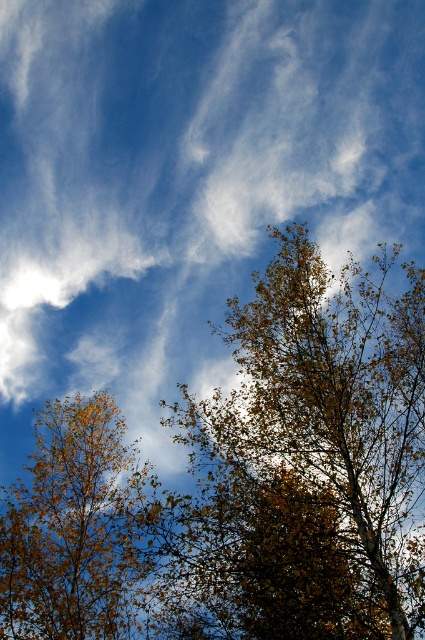
Question: Which of the following is the closest to the observer?

Choices:
 (A) brown leafy tree at center
 (B) golden-brown leaves at left

Answer: (A)

Question: Can you confirm if brown leafy tree at center is smaller than golden-brown leaves at left?

Choices:
 (A) no
 (B) yes

Answer: (A)

Question: Does brown leafy tree at center come in front of golden-brown leaves at left?

Choices:
 (A) no
 (B) yes

Answer: (B)

Question: Can you confirm if brown leafy tree at center is bigger than golden-brown leaves at left?

Choices:
 (A) yes
 (B) no

Answer: (A)

Question: Which of the following is the farthest from the observer?

Choices:
 (A) (379, 385)
 (B) (136, 618)

Answer: (A)